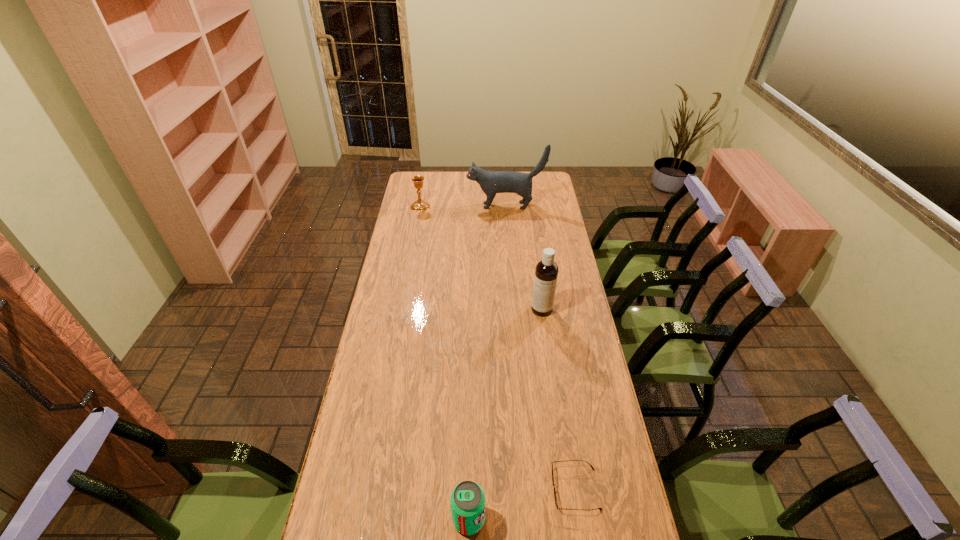
Locate an element on the screen. The width and height of the screenshot is (960, 540). vacant space at the left edge is located at coordinates [x=376, y=318].

In the image, there is a desktop. Identify the location of vacant space at the right edge. (550, 318).

In the image, there is a desktop. Identify the location of vacant area at the far left corner. The height and width of the screenshot is (540, 960). (426, 187).

At what (x,y) coordinates should I click in order to perform the action: click on free space between the pop soda and the shortest object. Please return your answer as a coordinate pair (x, y). Looking at the image, I should click on [522, 504].

You are a GUI agent. You are given a task and a screenshot of the screen. Output one action in this format:
    pyautogui.click(x=<x>, y=<y>)
    Task: Click on the free area in between the cat and the pop soda
    
    Given the screenshot: What is the action you would take?
    pyautogui.click(x=488, y=362)

Find the location of a particular element. vacant space that's between the leftmost object and the cat is located at coordinates (463, 206).

The width and height of the screenshot is (960, 540). Find the location of `free space between the chalice and the pop soda`. free space between the chalice and the pop soda is located at coordinates (444, 363).

What are the coordinates of `vacant area that lies between the pop soda and the fourth shortest object` in the screenshot? It's located at (505, 414).

At what (x,y) coordinates should I click in order to perform the action: click on free space between the spectacles and the fourth shortest object. Please return your answer as a coordinate pair (x, y). Looking at the image, I should click on (559, 399).

Locate an element on the screen. This screenshot has width=960, height=540. free space between the cat and the shortest object is located at coordinates (540, 347).